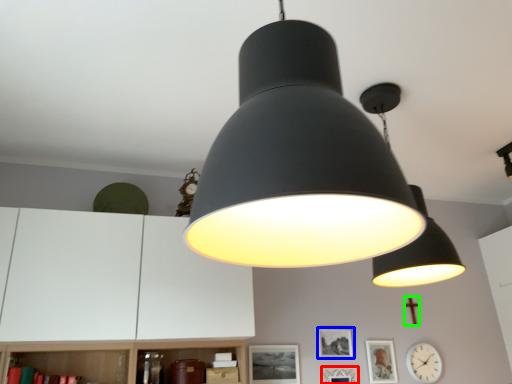
Question: Based on their relative distances, which object is farther from picture frame (highlighted by a red box)? Choose from picture frame (highlighted by a blue box) and crucifix (highlighted by a green box).

Choices:
 (A) picture frame
 (B) crucifix

Answer: (B)